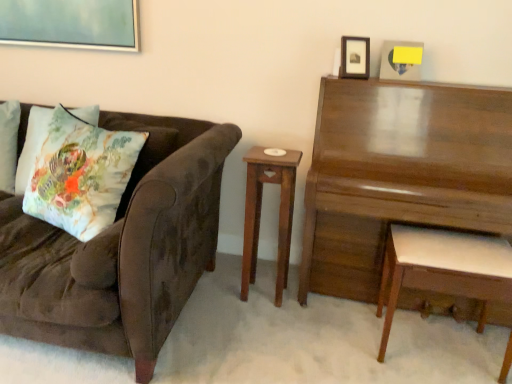
Find the location of a particular element. The width and height of the screenshot is (512, 384). free space below white wood stool at right (from a real-world perspective) is located at coordinates (435, 359).